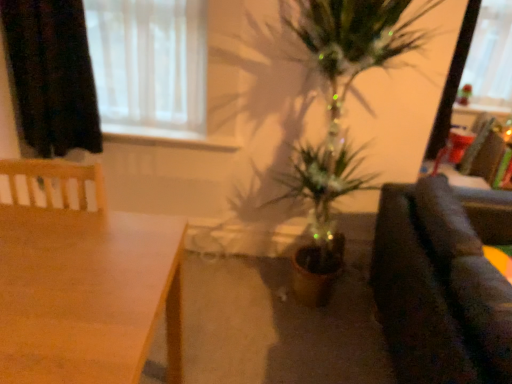
Question: Based on their sizes in the image, would you say white sheer curtain at upper left is bigger or smaller than black fabric curtain at upper left?

Choices:
 (A) big
 (B) small

Answer: (A)

Question: From a real-world perspective, is white sheer curtain at upper left above or below black fabric curtain at upper left?

Choices:
 (A) below
 (B) above

Answer: (B)

Question: Which object is the closest to the wooden table at lower left?

Choices:
 (A) white sheer curtain at upper left
 (B) dark fabric couch at right
 (C) transparent plastic window screen at upper right
 (D) black fabric curtain at upper left

Answer: (D)

Question: Estimate the real-world distances between objects in this image. Which object is farther from the wooden table at lower left?

Choices:
 (A) black fabric curtain at upper left
 (B) transparent plastic window screen at upper right
 (C) dark fabric couch at right
 (D) white sheer curtain at upper left

Answer: (B)